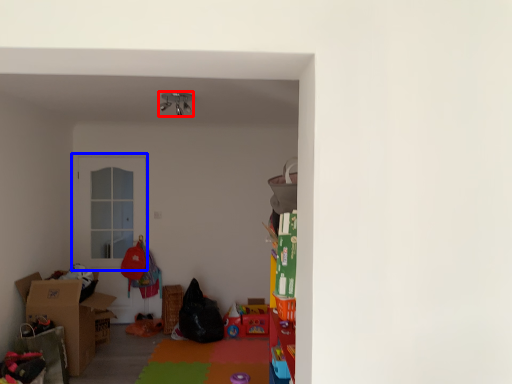
Question: Among these objects, which one is nearest to the camera, lamp (highlighted by a red box) or door (highlighted by a blue box)?

Choices:
 (A) lamp
 (B) door

Answer: (A)